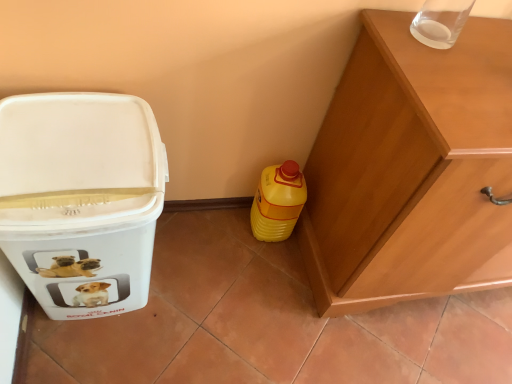
The image size is (512, 384). Find the location of `free space that is in between white plastic container at left and yellow plastic bottle at lower right`. free space that is in between white plastic container at left and yellow plastic bottle at lower right is located at coordinates (207, 252).